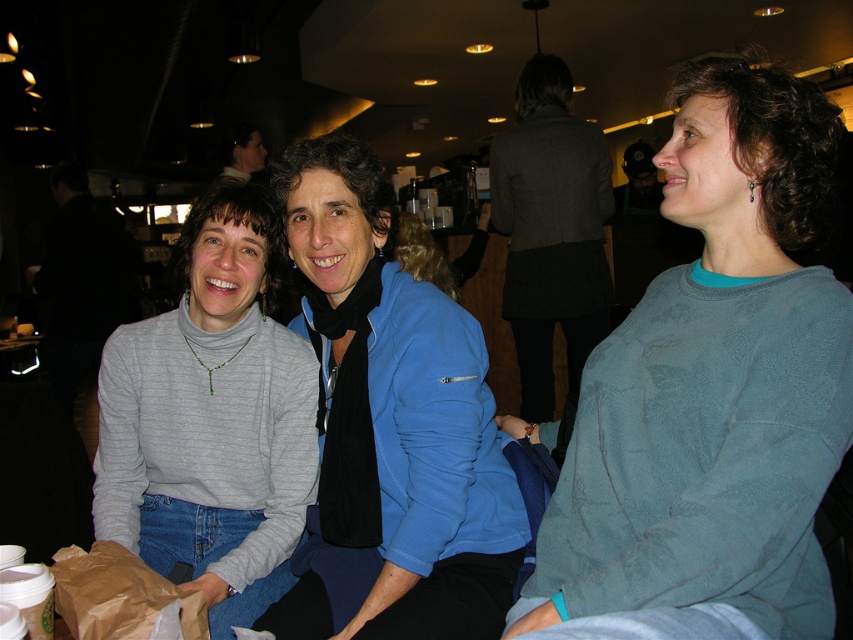
Question: Is gray turtleneck sweater at center below brown paper bag at lower left?

Choices:
 (A) no
 (B) yes

Answer: (A)

Question: Among these points, which one is nearest to the camera?

Choices:
 (A) (825, 358)
 (B) (189, 609)

Answer: (A)

Question: Can you confirm if gray turtleneck sweater at center is positioned to the right of brown paper bag at lower left?

Choices:
 (A) yes
 (B) no

Answer: (B)

Question: Is teal sweater at center in front of gray turtleneck sweater at center?

Choices:
 (A) no
 (B) yes

Answer: (B)

Question: Which point is farther to the camera?

Choices:
 (A) (161, 467)
 (B) (793, 304)

Answer: (A)

Question: Among these objects, which one is nearest to the camera?

Choices:
 (A) brown paper bag at lower left
 (B) gray turtleneck sweater at center
 (C) teal sweater at center
 (D) blue fleece jacket at center

Answer: (C)